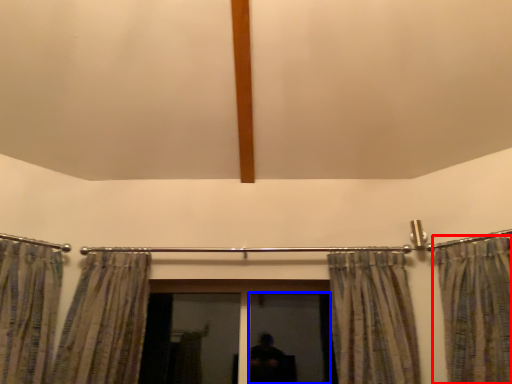
Question: Which of the following is the closest to the observer, curtain (highlighted by a red box) or screen door (highlighted by a blue box)?

Choices:
 (A) curtain
 (B) screen door

Answer: (A)